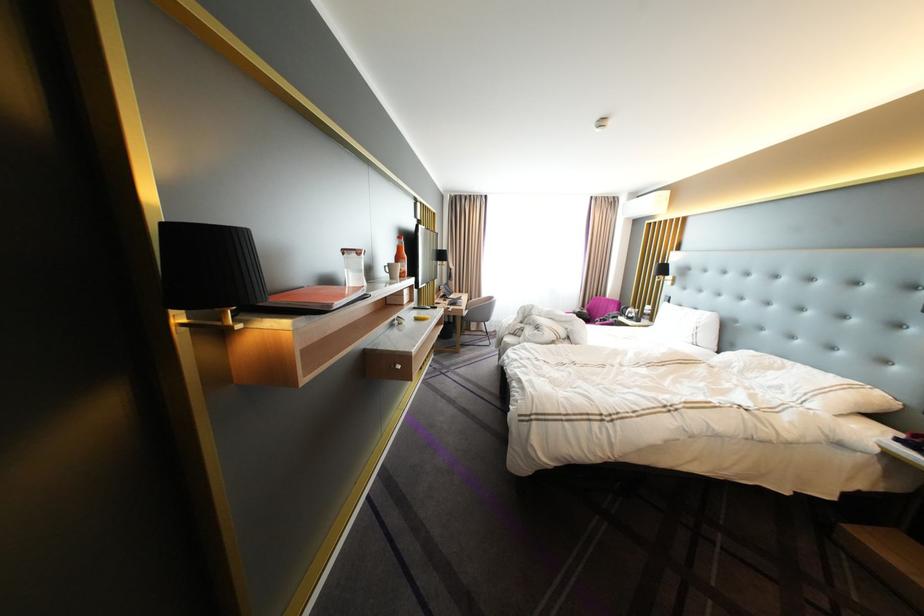
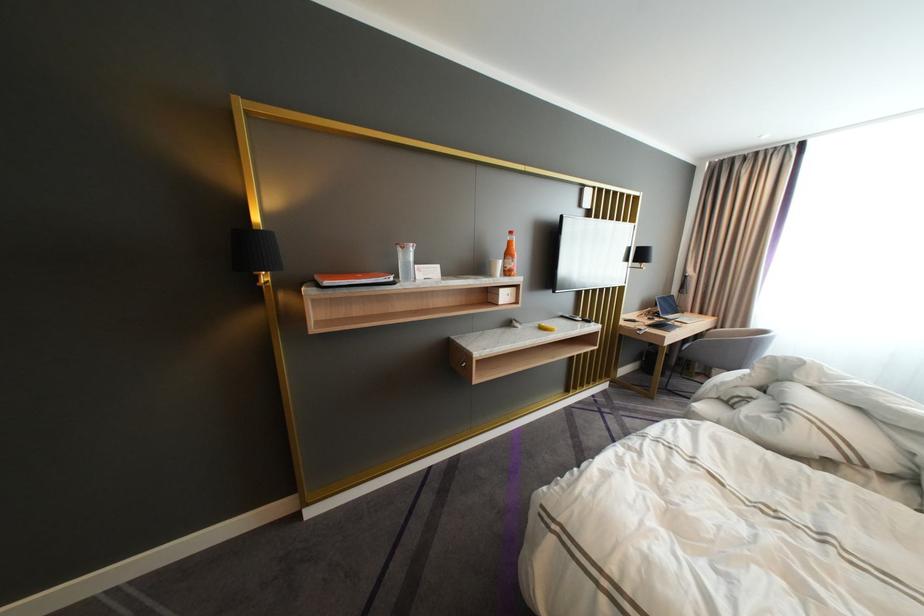
In the second image, find the point that corresponds to point (429, 307) in the first image.

(578, 315)